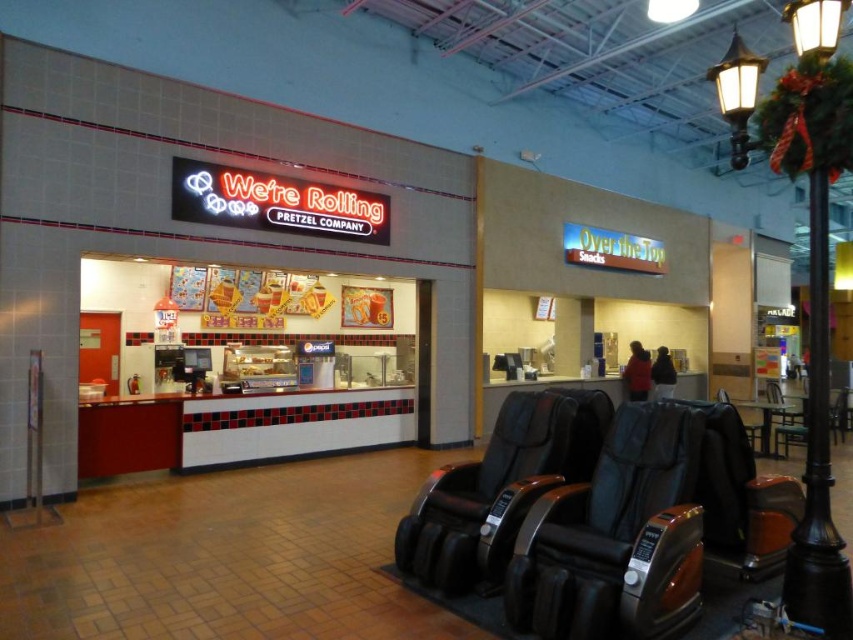
You are a customer standing at the entrance of the food court and want to take a photo of the neon sign of the We are Rolling Pretzel Company. You notice two points marked on the sign at coordinates point (664, 541) and point (744, 422). Which point should you focus on to ensure the neon sign is in sharp focus?

You should focus on point (664, 541) because it is closer to the camera than point (744, 422), so focusing on it will ensure the neon sign is in sharp focus.

You are a customer waiting in line at the pretzel stand. You see the black leather swivel chair at lower right and the black leather massage chair at center. Which chair is closer to the counter where you are standing?

The black leather swivel chair at lower right is closer to the counter where you are standing because it is to the left of the black leather massage chair at center, implying it is positioned nearer to the counter area.